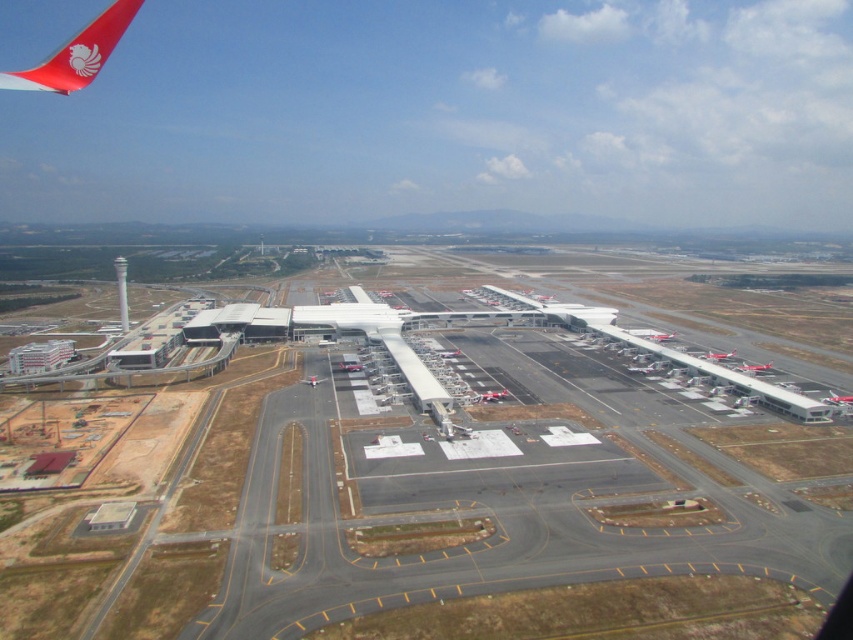
Question: Which object is closer to the camera taking this photo?

Choices:
 (A) metallic silver airplane at right
 (B) metallic silver airplane at center

Answer: (B)

Question: Can you confirm if metallic silver airplane at right is positioned above matte white airplane at center?

Choices:
 (A) yes
 (B) no

Answer: (A)

Question: Is metallic silver airplane at right closer to camera compared to metallic silver airplane at center?

Choices:
 (A) yes
 (B) no

Answer: (B)

Question: Does metallic silver airplane at center appear on the right side of matte white airplane at center?

Choices:
 (A) yes
 (B) no

Answer: (A)

Question: Based on their relative distances, which object is nearer to the gray concrete tarmac at center?

Choices:
 (A) metallic silver airplane at right
 (B) metallic silver airplane at center
 (C) red matte airplane winglet at upper left
 (D) matte white airplane at center

Answer: (B)

Question: Based on their relative distances, which object is nearer to the gray concrete tarmac at center?

Choices:
 (A) metallic silver airplane at right
 (B) matte white airplane at center

Answer: (B)